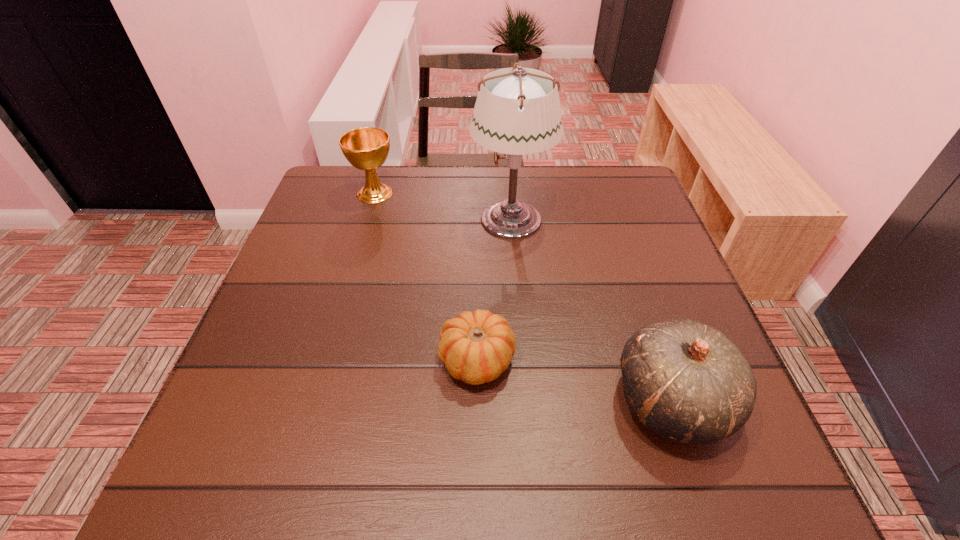
Locate an element on the screen. free space between the rightmost object and the lampshade is located at coordinates (591, 309).

Identify the location of free space between the rightmost object and the chalice. (523, 296).

This screenshot has width=960, height=540. Find the location of `vacant region between the leftmost object and the tallest object`. vacant region between the leftmost object and the tallest object is located at coordinates (443, 206).

You are a GUI agent. You are given a task and a screenshot of the screen. Output one action in this format:
    pyautogui.click(x=<x>, y=<y>)
    Task: Click on the vacant space in between the chalice and the shorter gourd
    
    Given the screenshot: What is the action you would take?
    pyautogui.click(x=426, y=276)

The height and width of the screenshot is (540, 960). I want to click on object that stands as the closest to the lampshade, so click(x=366, y=148).

Locate which object ranks in proximity to the shorter gourd. Please provide its 2D coordinates. Your answer should be formatted as a tuple, i.e. [(x, y)], where the tuple contains the x and y coordinates of a point satisfying the conditions above.

[(686, 381)]

At what (x,y) coordinates should I click in order to perform the action: click on vacant region that satisfies the following two spatial constraints: 1. on the lampshade of the tallest object; 2. on the left side of the right gourd. Please return your answer as a coordinate pair (x, y). Looking at the image, I should click on (525, 400).

Where is `vacant region that satisfies the following two spatial constraints: 1. on the lampshade of the tallest object; 2. on the right side of the taller gourd`? Image resolution: width=960 pixels, height=540 pixels. vacant region that satisfies the following two spatial constraints: 1. on the lampshade of the tallest object; 2. on the right side of the taller gourd is located at coordinates (525, 400).

Where is `vacant space that satisfies the following two spatial constraints: 1. on the lampshade of the tallest object; 2. on the front side of the left gourd`? The height and width of the screenshot is (540, 960). vacant space that satisfies the following two spatial constraints: 1. on the lampshade of the tallest object; 2. on the front side of the left gourd is located at coordinates (522, 360).

Image resolution: width=960 pixels, height=540 pixels. Find the location of `vacant space that satisfies the following two spatial constraints: 1. on the lampshade of the right gourd; 2. on the right side of the tallest object`. vacant space that satisfies the following two spatial constraints: 1. on the lampshade of the right gourd; 2. on the right side of the tallest object is located at coordinates (525, 400).